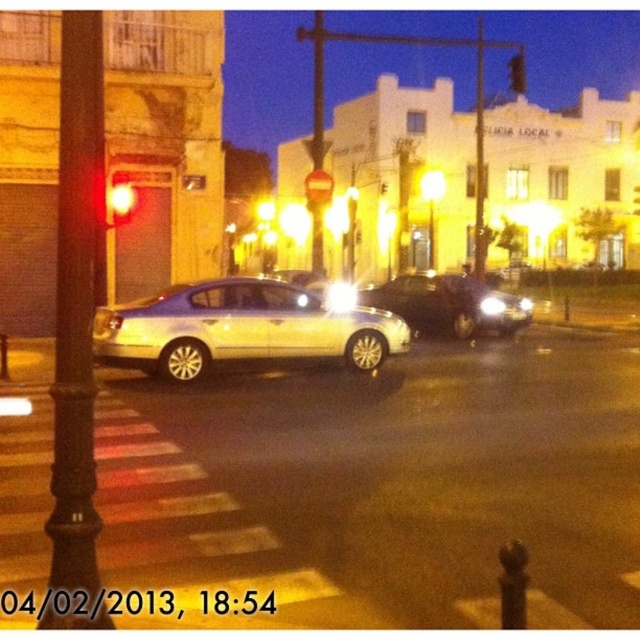
You are a driver approaching the intersection. You see the satin white sedan at center and the metallic traffic light at upper center. Which object appears larger in the scene?

The metallic traffic light at upper center appears larger than the satin white sedan at center in the scene.

You are a pedestrian waiting at the crosswalk. You see the satin white sedan at center and the red glass traffic light at upper left. Which object is closer to you?

The satin white sedan at center is closer to you because it is in front of the red glass traffic light at upper left.

You are a pedestrian waiting at the crosswalk. You see the satin black sedan at center and the red glass traffic light at upper left. Which object is closer to you?

The satin black sedan at center is closer to you because the red glass traffic light at upper left is behind it.